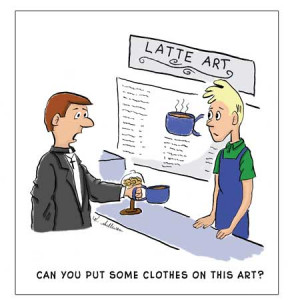
What are the coordinates of `corner` in the screenshot? It's located at (107, 153).